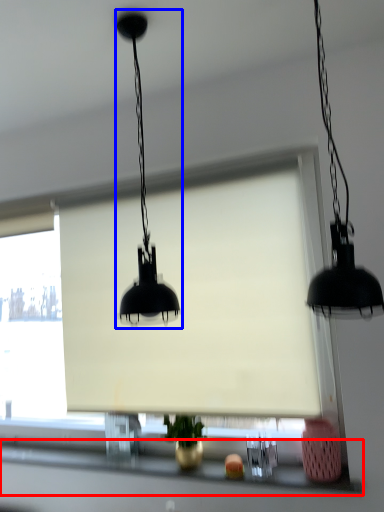
Question: Among these objects, which one is farthest to the camera, window sill (highlighted by a red box) or lamp (highlighted by a blue box)?

Choices:
 (A) window sill
 (B) lamp

Answer: (A)